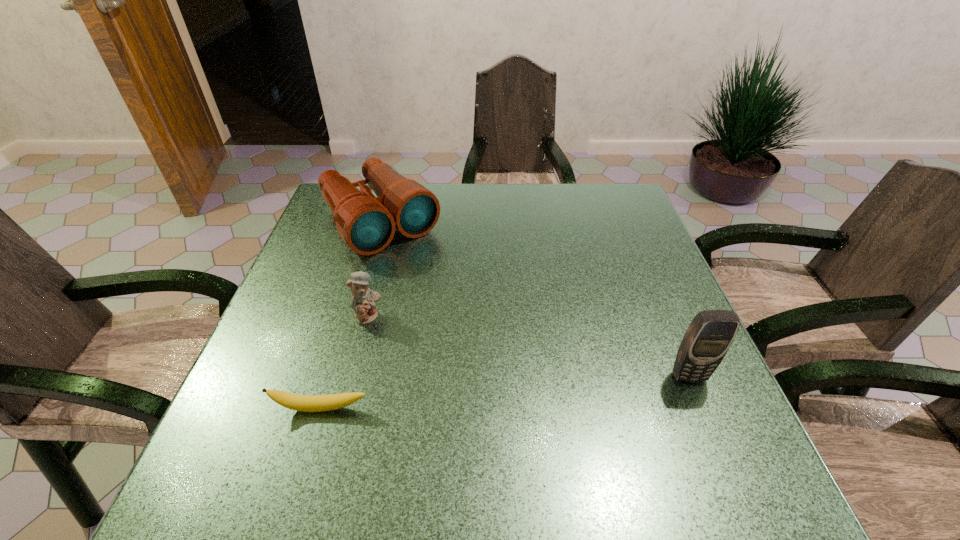
Image resolution: width=960 pixels, height=540 pixels. What are the coordinates of `object at the far left corner` in the screenshot? It's located at (367, 223).

Where is `object at the near left corner`? This screenshot has width=960, height=540. object at the near left corner is located at coordinates (305, 403).

In the image, there is a desktop. Where is `vacant region at the far edge`? Image resolution: width=960 pixels, height=540 pixels. vacant region at the far edge is located at coordinates (459, 185).

Locate an element on the screen. vacant space at the near edge is located at coordinates (564, 415).

Locate an element on the screen. The height and width of the screenshot is (540, 960). vacant space at the left edge is located at coordinates (301, 255).

Locate an element on the screen. This screenshot has width=960, height=540. vacant space at the right edge of the desktop is located at coordinates (634, 322).

Identify the location of free spot at the far right corner of the desktop. (614, 191).

Identify the location of unoccupied area between the rightmost object and the binoculars. Image resolution: width=960 pixels, height=540 pixels. (x=535, y=299).

Where is `vacant space in between the teddy bear and the second nearest object`? vacant space in between the teddy bear and the second nearest object is located at coordinates (x=529, y=347).

I want to click on free point between the second tallest object and the third nearest object, so click(x=374, y=269).